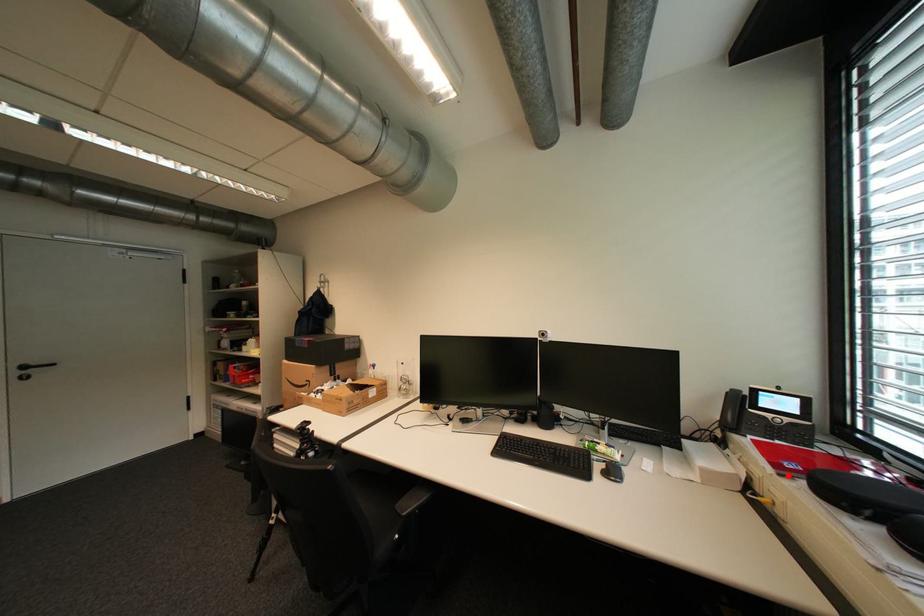
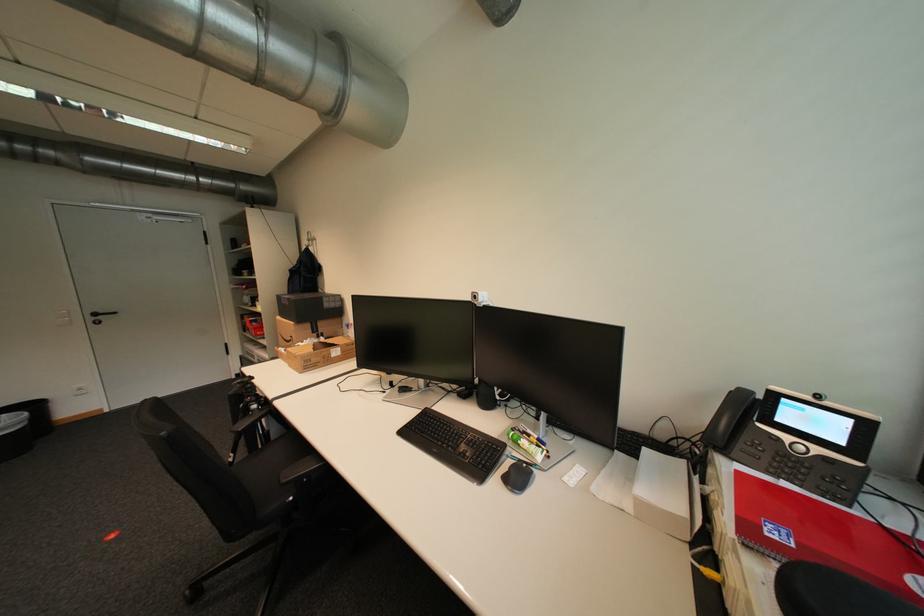
Where in the second image is the point corresponding to the highlighted location from the first image?

(754, 545)